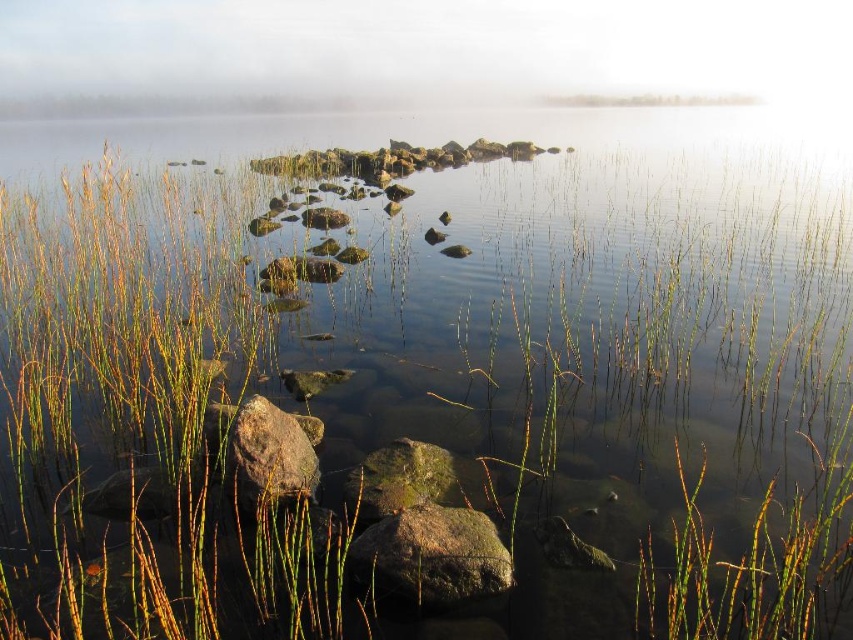
Can you confirm if rusty metallic boulder at lower left is positioned above green mossy rock at center?

Correct, rusty metallic boulder at lower left is located above green mossy rock at center.

Does rusty metallic boulder at lower left have a larger size compared to green mossy rock at center?

Yes.

This screenshot has height=640, width=853. Find the location of `rusty metallic boulder at lower left`. rusty metallic boulder at lower left is located at coordinates (260, 451).

Locate an element on the screen. This screenshot has height=640, width=853. rusty metallic boulder at lower left is located at coordinates (260, 451).

Does green matte grass at center appear under green mossy rock at lower center?

No, green matte grass at center is not below green mossy rock at lower center.

Who is more forward, [846,502] or [469,598]?

Point [469,598] is more forward.

Identify the location of green matte grass at center. This screenshot has height=640, width=853. (753, 561).

Is green grass at center behind green mossy rock at lower center?

No.

Does point (322, 538) lie behind point (407, 582)?

Yes, point (322, 538) is farther from viewer.

What are the coordinates of `green grass at center` in the screenshot? It's located at (146, 420).